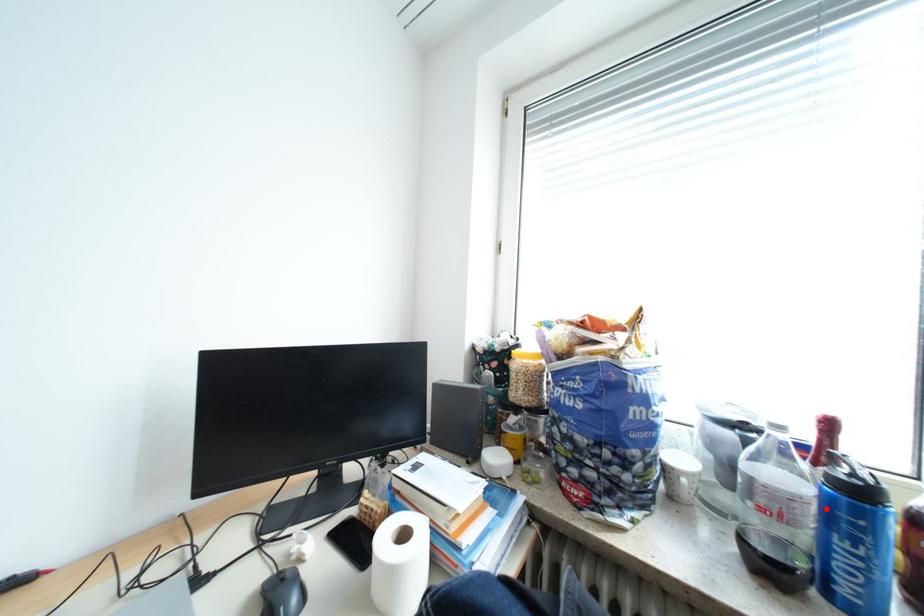
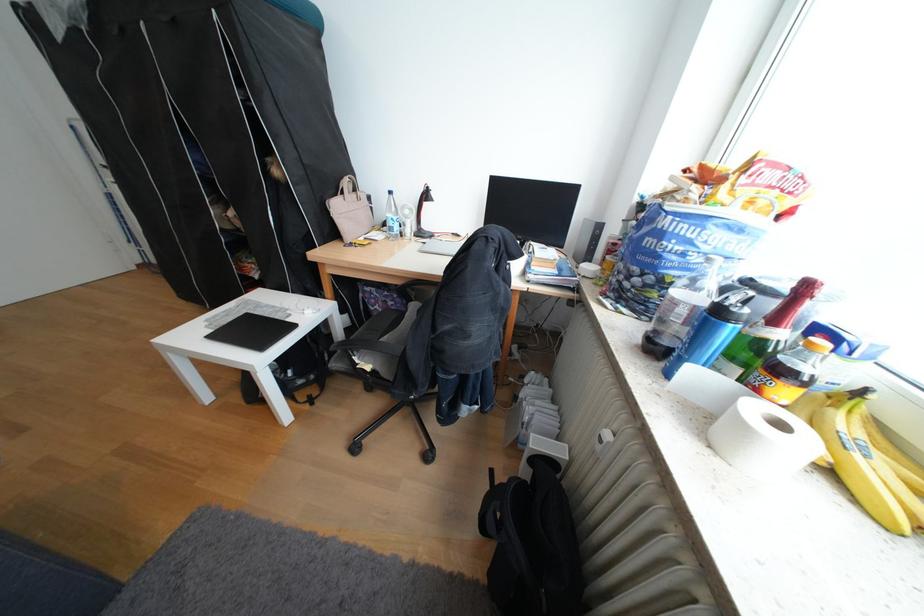
Find the pixel in the second image that matches the highlighted location in the first image.

(695, 312)